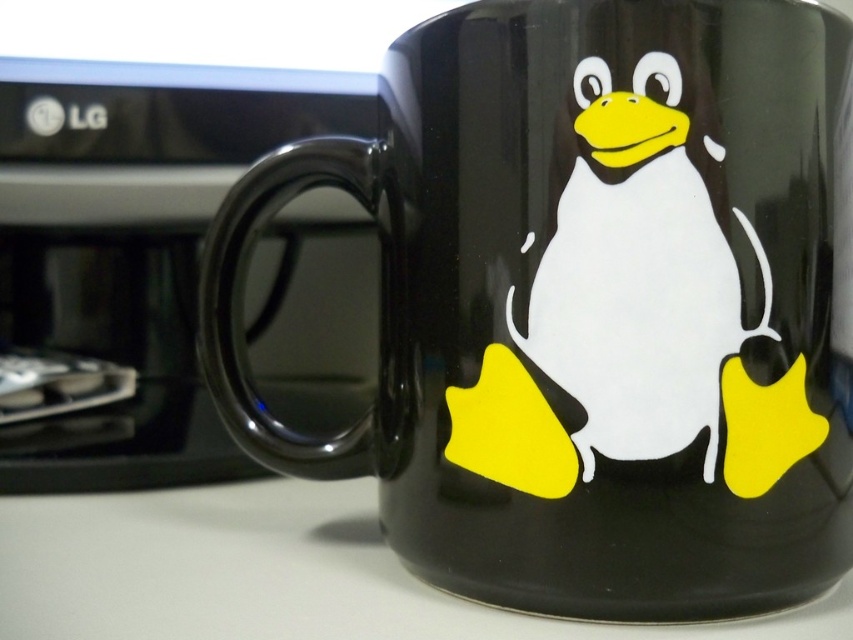
Does white glossy table at lower center appear on the left side of white glossy penguin at center?

Indeed, white glossy table at lower center is positioned on the left side of white glossy penguin at center.

The width and height of the screenshot is (853, 640). In order to click on white glossy table at lower center in this screenshot , I will do `click(267, 572)`.

Can you confirm if black glossy monitor at upper left is taller than white glossy penguin at center?

Correct, black glossy monitor at upper left is much taller as white glossy penguin at center.

Is point (186, 214) less distant than point (589, 170)?

No, (186, 214) is behind (589, 170).

Locate an element on the screen. Image resolution: width=853 pixels, height=640 pixels. black glossy monitor at upper left is located at coordinates (132, 246).

Does black glossy monitor at upper left appear on the left side of white glossy table at lower center?

Correct, you'll find black glossy monitor at upper left to the left of white glossy table at lower center.

You are a GUI agent. You are given a task and a screenshot of the screen. Output one action in this format:
    pyautogui.click(x=<x>, y=<y>)
    Task: Click on the black glossy monitor at upper left
    
    Given the screenshot: What is the action you would take?
    click(x=132, y=246)

Who is more forward, (x=316, y=100) or (x=86, y=548)?

Point (x=86, y=548) is more forward.

Identify the location of black glossy monitor at upper left. (132, 246).